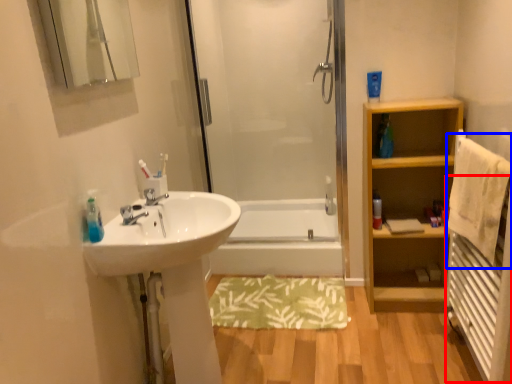
Question: Among these objects, which one is nearest to the camera, radiator (highlighted by a red box) or bath towel (highlighted by a blue box)?

Choices:
 (A) radiator
 (B) bath towel

Answer: (A)